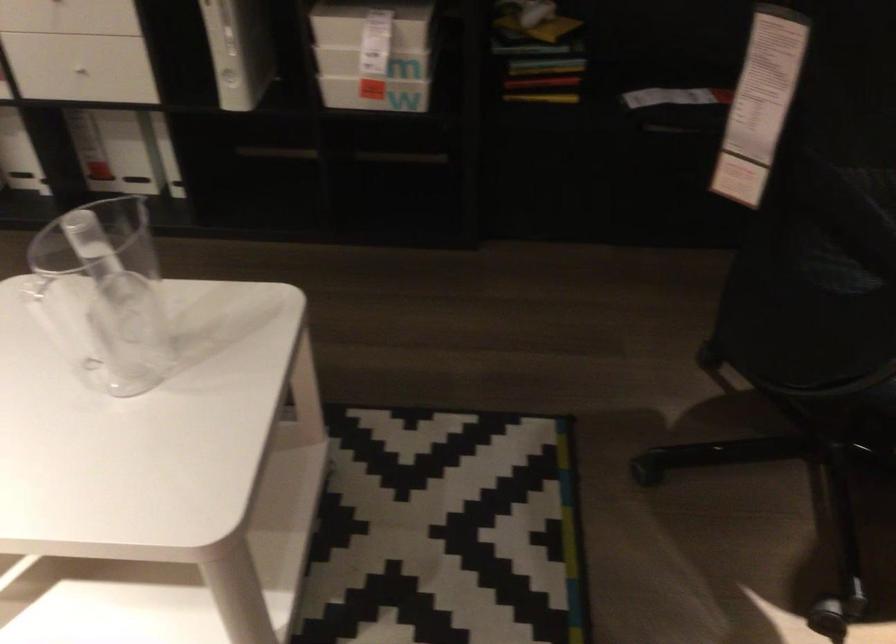
Describe the element at coordinates (75, 77) in the screenshot. The height and width of the screenshot is (644, 896). I see `the white drawer handle` at that location.